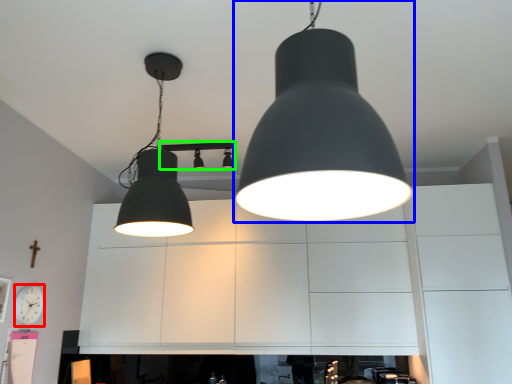
Question: Which object is positioned farthest from clock (highlighted by a red box)? Select from lamp (highlighted by a blue box) and lamp (highlighted by a green box).

Choices:
 (A) lamp
 (B) lamp

Answer: (A)